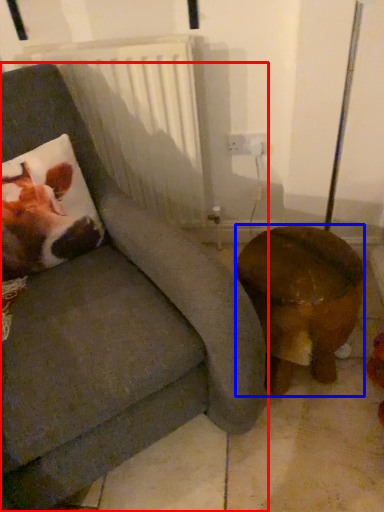
Question: Among these objects, which one is farthest to the camera, chair (highlighted by a red box) or furniture (highlighted by a blue box)?

Choices:
 (A) chair
 (B) furniture

Answer: (B)